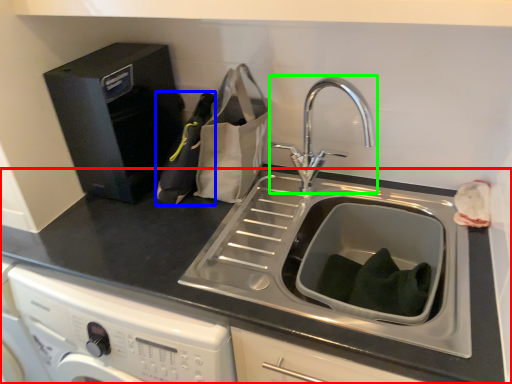
Question: Which is farther away from countertop (highlighted by a red box)? bottle (highlighted by a blue box) or tap (highlighted by a green box)?

Choices:
 (A) bottle
 (B) tap

Answer: (B)